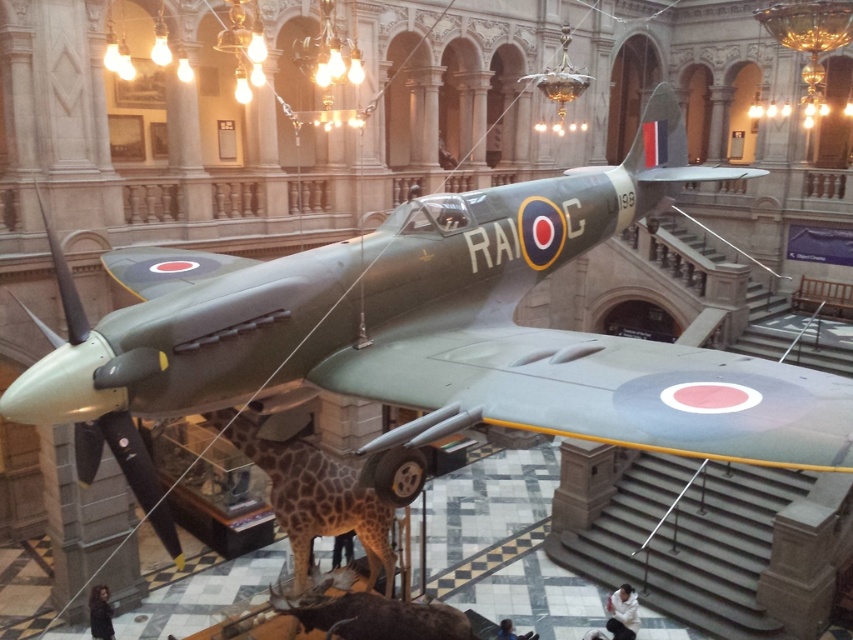
Question: Is spotted fur giraffe at center to the right of shiny brown antelope at lower center from the viewer's perspective?

Choices:
 (A) yes
 (B) no

Answer: (B)

Question: Is spotted fur giraffe at center to the left of shiny brown antelope at lower center from the viewer's perspective?

Choices:
 (A) no
 (B) yes

Answer: (B)

Question: Which point is closer to the camera?

Choices:
 (A) shiny brown antelope at lower center
 (B) spotted fur giraffe at center

Answer: (B)

Question: Does spotted fur giraffe at center appear under shiny brown antelope at lower center?

Choices:
 (A) yes
 (B) no

Answer: (B)

Question: Among these points, which one is farthest from the camera?

Choices:
 (A) (448, 612)
 (B) (355, 483)

Answer: (B)

Question: Which point is closer to the camera taking this photo?

Choices:
 (A) (358, 518)
 (B) (276, 609)

Answer: (B)